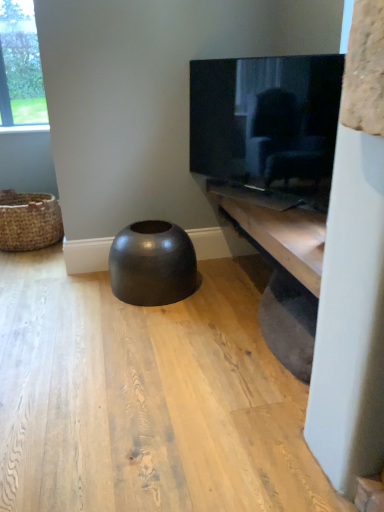
Find the location of a particular element. The image size is (384, 512). free point below matte black tv at upper right (from a real-world perspective) is located at coordinates (272, 203).